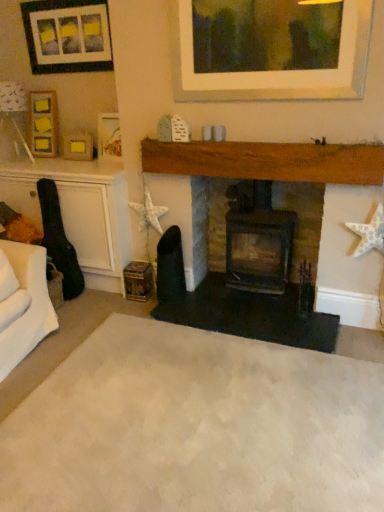
Question: Is matte wooden picture frame at upper left, arranged as the 2th picture frame when ordered from the bottom, in front of or behind black matte fireplace at center, the second fireplace positioned from the left, in the image?

Choices:
 (A) front
 (B) behind

Answer: (B)

Question: Based on their sizes in the image, would you say matte wooden picture frame at upper left, arranged as the 2th picture frame when ordered from the bottom, is bigger or smaller than black matte fireplace at center, the first fireplace viewed from the right?

Choices:
 (A) small
 (B) big

Answer: (A)

Question: Considering the real-world distances, which object is closest to the matte wooden picture frame at upper left, the third picture frame viewed from the top?

Choices:
 (A) matte black picture frame at upper left, acting as the 4th picture frame starting from the bottom
 (B) black matte fireplace at center, the first fireplace viewed from the right
 (C) beige carpet at center
 (D) matte gold picture frame at upper left, which appears as the first picture frame when ordered from the bottom
 (E) wooden picture frame at upper left, the third picture frame positioned from the bottom

Answer: (D)

Question: Estimate the real-world distances between objects in this image. Which object is closer to the black matte fireplace at center, the first fireplace viewed from the right?

Choices:
 (A) matte black fireplace at center, placed as the first fireplace when sorted from left to right
 (B) matte gold picture frame at upper left, placed as the 4th picture frame when sorted from top to bottom
 (C) beige carpet at center
 (D) matte wooden picture frame at upper left, the third picture frame viewed from the top
 (E) matte black picture frame at upper left, acting as the 4th picture frame starting from the bottom

Answer: (A)